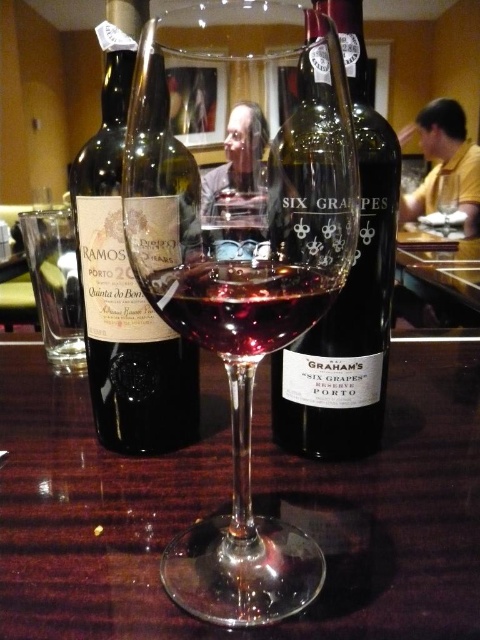
You are at a wine tasting event and see the transparent glass wine glass at center and the black matte bottle at center. Which object is positioned to the left of the other?

The transparent glass wine glass at center is to the left of the black matte bottle at center.

From the picture: You are a sommelier standing at the table. You need to reach the point at coordinates point (x=170, y=534) to taste the wine. Your hand can extend 25 centimeters. Can you reach it?

The distance between point (x=170, y=534) and the camera is 27.36 centimeters. Since your hand can only extend 25 centimeters, you cannot reach the point (x=170, y=534).